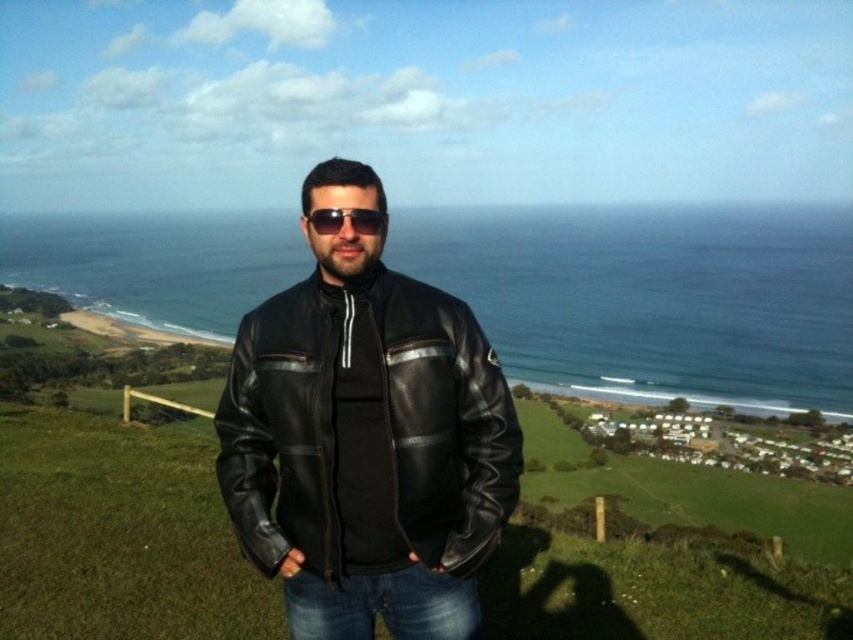
Is green grass at center further to the viewer compared to sunglasses at center?

Yes, it is.

Consider the image. Who is higher up, green grass at center or sunglasses at center?

Positioned higher is sunglasses at center.

Is point (596, 563) positioned behind point (341, 212)?

Yes.

Find the location of `green grass at center`. green grass at center is located at coordinates (119, 532).

Which of these two, black leather jacket at center or jeans at center, stands taller?

With more height is black leather jacket at center.

Is black leather jacket at center in front of jeans at center?

No, it is behind jeans at center.

Does point (354, 588) come closer to viewer compared to point (434, 573)?

No, (354, 588) is behind (434, 573).

Locate an element on the screen. black leather jacket at center is located at coordinates 366,438.

Is black leather jacket at center to the left of sunglasses at center from the viewer's perspective?

Correct, you'll find black leather jacket at center to the left of sunglasses at center.

Does black leather jacket at center have a smaller size compared to sunglasses at center?

Incorrect, black leather jacket at center is not smaller in size than sunglasses at center.

Locate an element on the screen. This screenshot has height=640, width=853. black leather jacket at center is located at coordinates (366, 438).

Image resolution: width=853 pixels, height=640 pixels. In order to click on black leather jacket at center in this screenshot , I will do `click(366, 438)`.